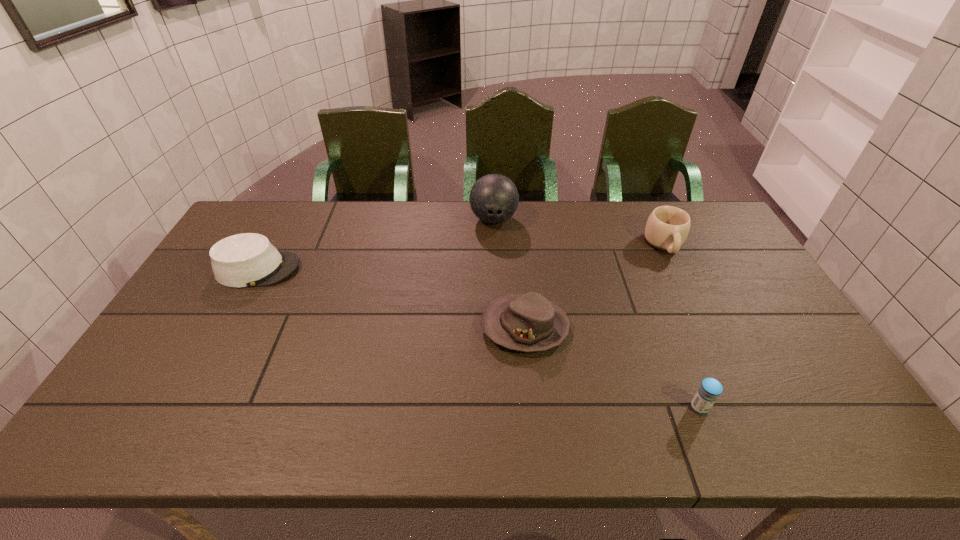
Identify the location of the tallest object. (494, 198).

Identify the location of the rightmost object. (667, 228).

Identify the location of the left hat. The width and height of the screenshot is (960, 540). (244, 260).

The image size is (960, 540). In order to click on the leftmost object in this screenshot , I will do `click(244, 260)`.

This screenshot has width=960, height=540. I want to click on the right hat, so click(x=529, y=322).

At what (x,y) coordinates should I click in order to perform the action: click on the nearer hat. Please return your answer as a coordinate pair (x, y). Image resolution: width=960 pixels, height=540 pixels. Looking at the image, I should click on (529, 322).

Where is `medicine`? Image resolution: width=960 pixels, height=540 pixels. medicine is located at coordinates (707, 394).

Locate an element on the screen. the nearest object is located at coordinates (707, 394).

Where is `vacant space located 0.180m on the grip area of the bowling ball`? This screenshot has height=540, width=960. vacant space located 0.180m on the grip area of the bowling ball is located at coordinates (495, 269).

This screenshot has height=540, width=960. What are the coordinates of `vacant region located on the side of the rightmost object with the handle` in the screenshot? It's located at (718, 354).